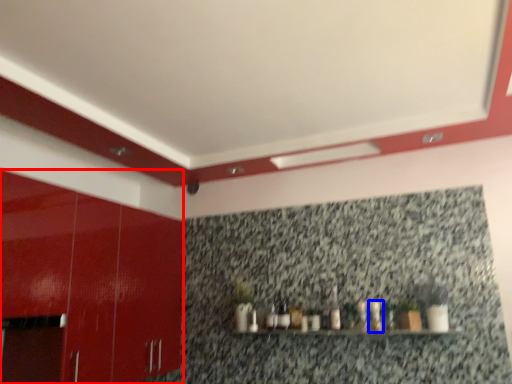
Question: Which point is further to the camera, cabinetry (highlighted by a red box) or bottle (highlighted by a blue box)?

Choices:
 (A) cabinetry
 (B) bottle

Answer: (B)